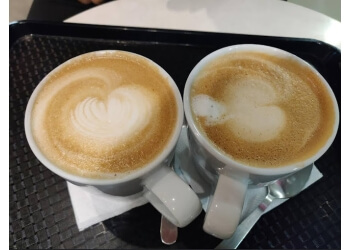
Locate an element on the screen. This screenshot has height=250, width=350. mug handles is located at coordinates (185, 199), (224, 187).